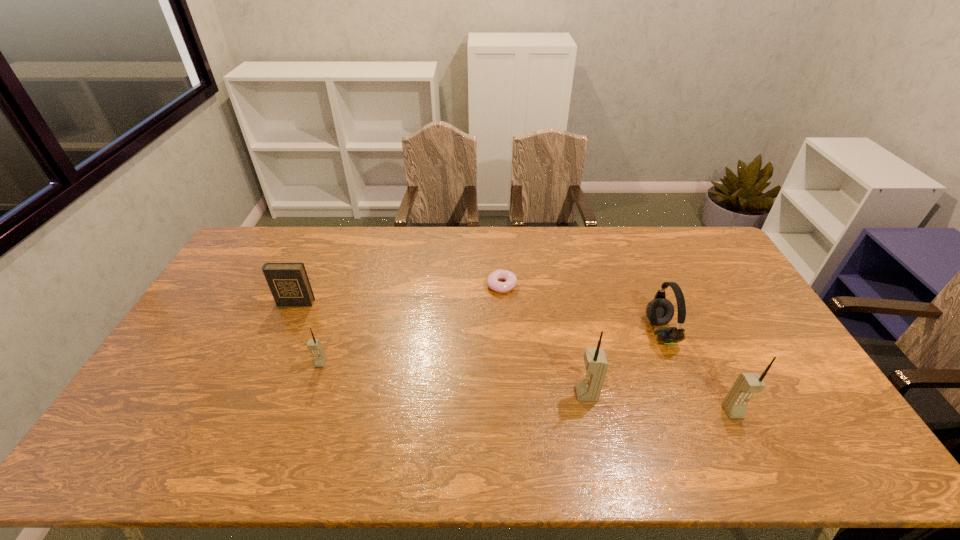
Where is `free point between the rightmost object and the third farthest object`? The image size is (960, 540). free point between the rightmost object and the third farthest object is located at coordinates (697, 372).

Locate an element on the screen. Image resolution: width=960 pixels, height=540 pixels. empty location between the third object from left to right and the headset is located at coordinates tap(581, 309).

This screenshot has width=960, height=540. I want to click on vacant area that lies between the leftmost object and the leftmost cellular telephone, so click(x=308, y=333).

Where is `vacant region between the third farthest object and the fifth nearest object`? Image resolution: width=960 pixels, height=540 pixels. vacant region between the third farthest object and the fifth nearest object is located at coordinates (478, 318).

Find the location of a particular element. The height and width of the screenshot is (540, 960). free space between the second farthest cellular telephone and the nearest cellular telephone is located at coordinates (660, 403).

Where is `vacant area that lies between the diary and the fifth shortest object`? Image resolution: width=960 pixels, height=540 pixels. vacant area that lies between the diary and the fifth shortest object is located at coordinates (515, 357).

Identify which object is the fourth closest to the second object from right to left. Please provide its 2D coordinates. Your answer should be formatted as a tuple, i.e. [(x, y)], where the tuple contains the x and y coordinates of a point satisfying the conditions above.

[(314, 345)]

Image resolution: width=960 pixels, height=540 pixels. I want to click on the closest object to the second tallest cellular telephone, so click(660, 311).

Find the location of a particular element. cellular telephone that is the second closest to the fifth farthest object is located at coordinates [x=314, y=345].

Where is `cellular telephone identified as the second closest to the diary`? cellular telephone identified as the second closest to the diary is located at coordinates click(588, 389).